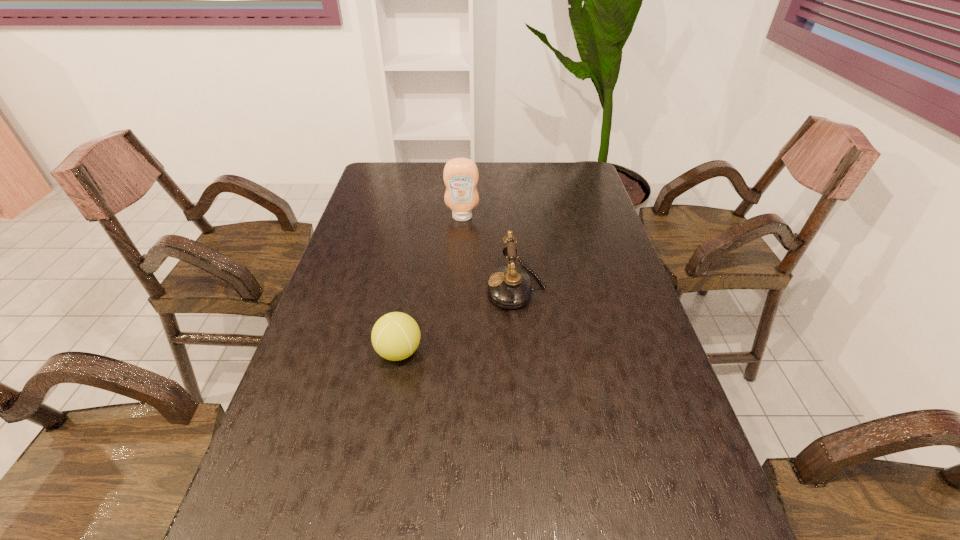
Identify which object is the second closest to the leftmost object. Please provide its 2D coordinates. Your answer should be formatted as a tuple, i.e. [(x, y)], where the tuple contains the x and y coordinates of a point satisfying the conditions above.

[(460, 175)]

Identify the location of the closest object to the tallest object. The height and width of the screenshot is (540, 960). (509, 287).